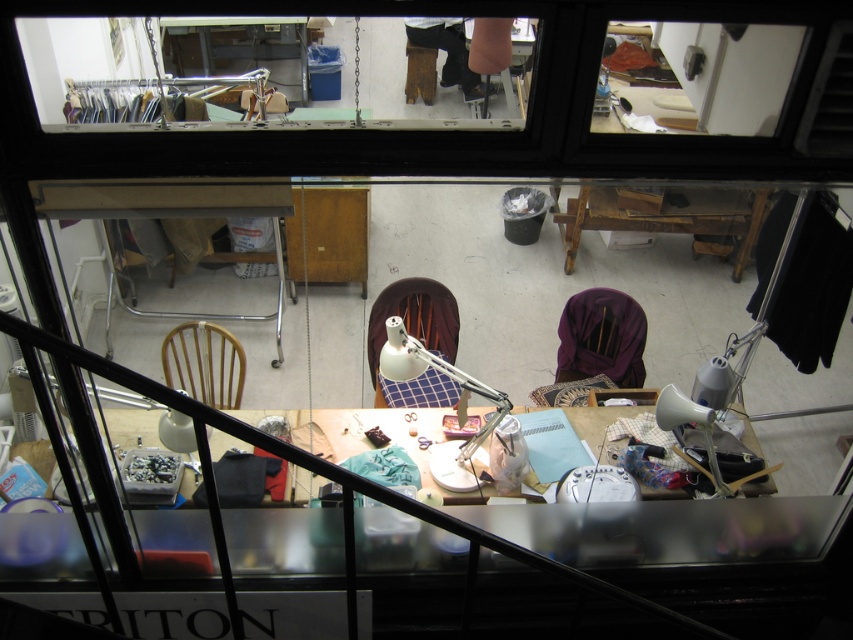
Is purple fabric chair at center above wooden chair at center-left?

Indeed, purple fabric chair at center is positioned over wooden chair at center-left.

Does purple fabric chair at center have a lesser height compared to wooden chair at center-left?

No.

Between point (636, 321) and point (221, 408), which one is positioned behind?

The point (636, 321) is behind.

Where is `purple fabric chair at center`? Image resolution: width=853 pixels, height=640 pixels. purple fabric chair at center is located at coordinates (598, 340).

Which is more to the right, white fabric chair at center or dark brown leather pants at upper center?

dark brown leather pants at upper center is more to the right.

This screenshot has width=853, height=640. What do you see at coordinates (415, 316) in the screenshot? I see `white fabric chair at center` at bounding box center [415, 316].

The image size is (853, 640). In order to click on white fabric chair at center in this screenshot , I will do `click(415, 316)`.

Who is more forward, (206, 381) or (415, 346)?

Point (415, 346)

Which is in front, point (206, 349) or point (465, 374)?

Point (465, 374) is in front.

Where is `wooden chair at center-left`? This screenshot has width=853, height=640. wooden chair at center-left is located at coordinates (204, 364).